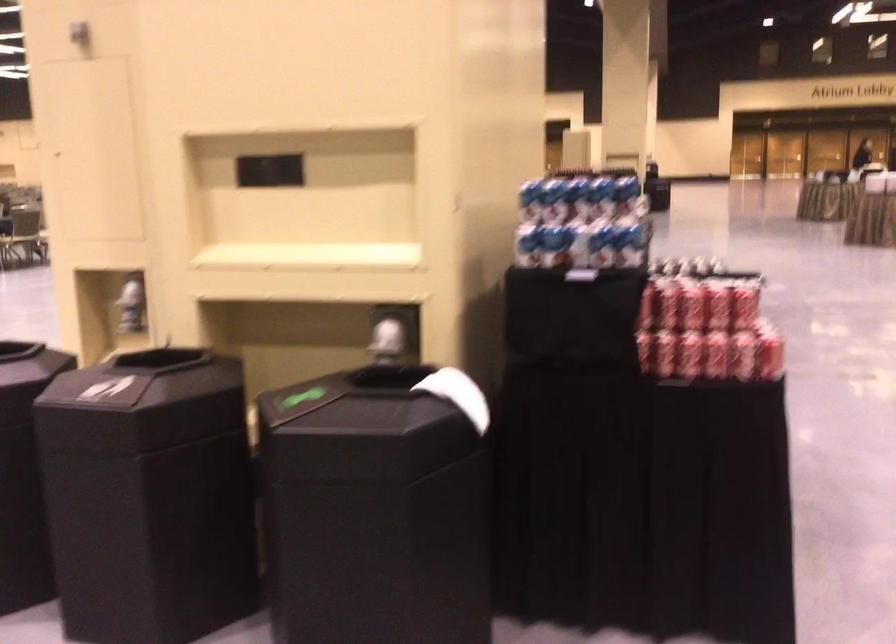
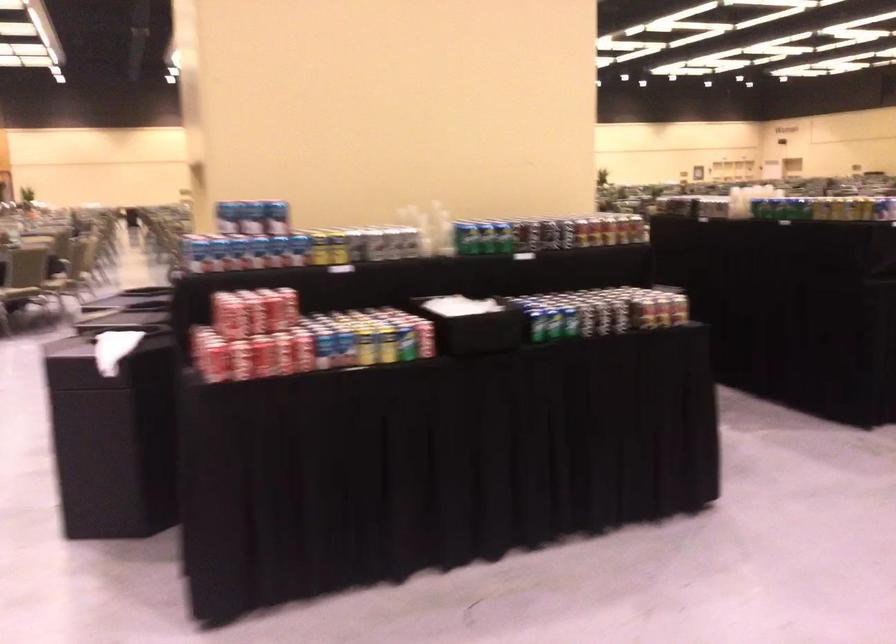
Find the pixel in the second image that matches point 606,202 in the first image.

(257, 216)